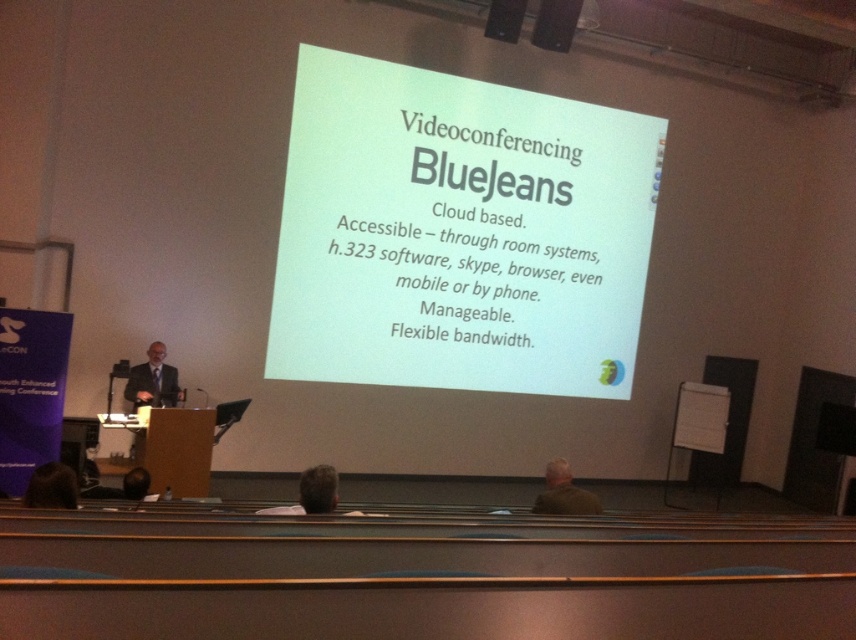
Does gray hair at center have a larger size compared to dark brown hair at lower left?

Yes, gray hair at center is bigger than dark brown hair at lower left.

Which is more to the left, gray hair at center or dark brown hair at lower left?

From the viewer's perspective, dark brown hair at lower left appears more on the left side.

The image size is (856, 640). Find the location of `gray hair at center`. gray hair at center is located at coordinates (311, 493).

You are a GUI agent. You are given a task and a screenshot of the screen. Output one action in this format:
    pyautogui.click(x=<x>, y=<y>)
    Task: Click on the gray hair at center
    This screenshot has width=856, height=640.
    Given the screenshot: What is the action you would take?
    pyautogui.click(x=311, y=493)

Can you confirm if dark gray suit at left is taller than dark brown hair at lower left?

Yes, dark gray suit at left is taller than dark brown hair at lower left.

Who is more forward, (165,365) or (28,497)?

Positioned in front is point (28,497).

Does point (159, 380) lie behind point (56, 500)?

Yes.

This screenshot has width=856, height=640. What are the coordinates of `dark gray suit at left` in the screenshot? It's located at (153, 380).

Which of these two, white paper at center or brown fabric jacket at lower center, stands shorter?

Standing shorter between the two is brown fabric jacket at lower center.

Is point (298, 104) positioned before point (578, 506)?

No, it is not.

Measure the distance between point (x=468, y=312) and camera.

A distance of 27.20 feet exists between point (x=468, y=312) and camera.

In order to click on white paper at center in this screenshot , I will do `click(459, 234)`.